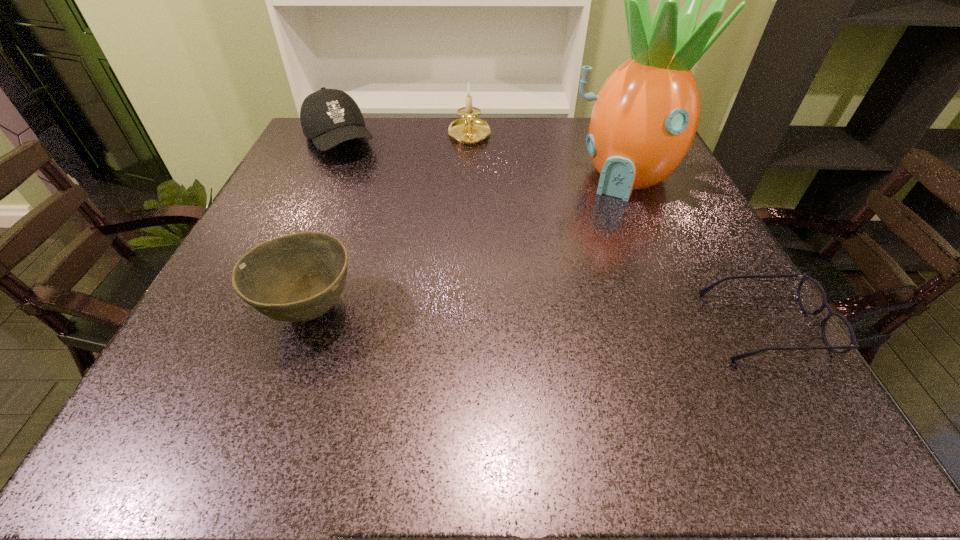
Locate an element on the screen. The width and height of the screenshot is (960, 540). free space on the desktop that is between the bowl and the spectacles and is positioned on the handle side of the candle holder is located at coordinates (485, 316).

This screenshot has height=540, width=960. Find the location of `free space on the desktop that is between the bowl and the shortest object and is positioned on the front-facing side of the baseball cap`. free space on the desktop that is between the bowl and the shortest object and is positioned on the front-facing side of the baseball cap is located at coordinates [x=467, y=316].

Locate an element on the screen. vacant spot on the desktop that is between the bowl and the spectacles and is positioned at the entrance of the pineapple is located at coordinates [x=557, y=319].